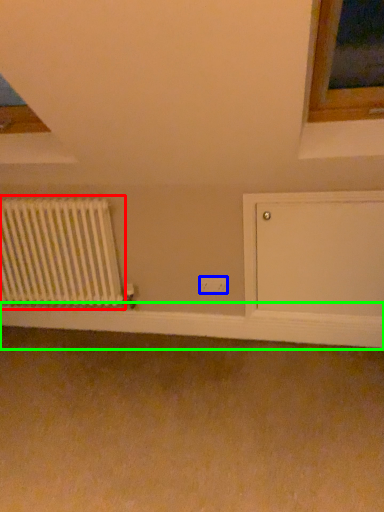
Question: Which object is the farthest from radiator (highlighted by a red box)? Choose among these: electric outlet (highlighted by a blue box) or window sill (highlighted by a green box).

Choices:
 (A) electric outlet
 (B) window sill

Answer: (A)